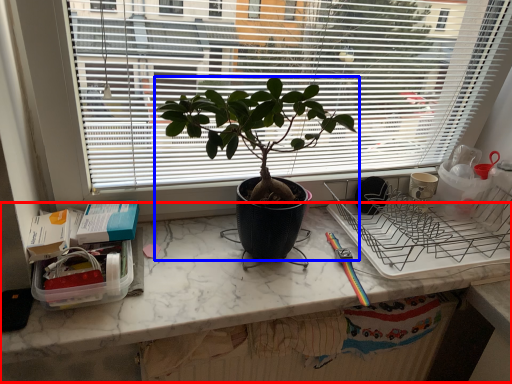
Question: Among these objects, which one is nearest to the camera, computer desk (highlighted by a red box) or houseplant (highlighted by a blue box)?

Choices:
 (A) computer desk
 (B) houseplant

Answer: (B)